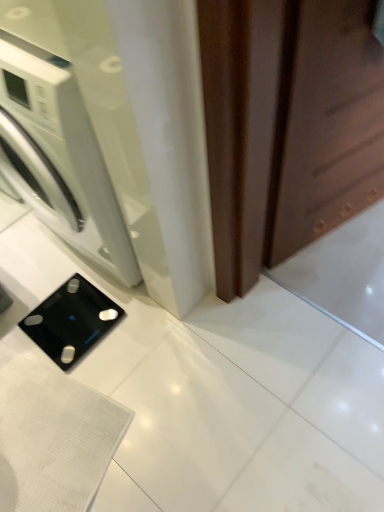
Question: Can you confirm if black glass scale at lower left is wider than brown matte screen door at right?

Choices:
 (A) yes
 (B) no

Answer: (A)

Question: Is black glass scale at lower left positioned with its back to brown matte screen door at right?

Choices:
 (A) yes
 (B) no

Answer: (B)

Question: Is black glass scale at lower left thinner than brown matte screen door at right?

Choices:
 (A) yes
 (B) no

Answer: (B)

Question: Can you confirm if black glass scale at lower left is bigger than brown matte screen door at right?

Choices:
 (A) yes
 (B) no

Answer: (B)

Question: Would you say black glass scale at lower left is outside brown matte screen door at right?

Choices:
 (A) yes
 (B) no

Answer: (A)

Question: Can you confirm if black glass scale at lower left is shorter than brown matte screen door at right?

Choices:
 (A) no
 (B) yes

Answer: (B)

Question: Is white glossy washing machine at left to the right of brown matte screen door at right from the viewer's perspective?

Choices:
 (A) yes
 (B) no

Answer: (B)

Question: Is white glossy washing machine at left directly adjacent to brown matte screen door at right?

Choices:
 (A) yes
 (B) no

Answer: (B)

Question: From a real-world perspective, is white glossy washing machine at left on brown matte screen door at right?

Choices:
 (A) no
 (B) yes

Answer: (A)

Question: Is white glossy washing machine at left further to camera compared to brown matte screen door at right?

Choices:
 (A) yes
 (B) no

Answer: (A)

Question: From the image's perspective, is white glossy washing machine at left above brown matte screen door at right?

Choices:
 (A) no
 (B) yes

Answer: (A)

Question: Is white glossy washing machine at left at the left side of brown matte screen door at right?

Choices:
 (A) no
 (B) yes

Answer: (B)

Question: From a real-world perspective, is brown matte screen door at right positioned over black glass scale at lower left based on gravity?

Choices:
 (A) no
 (B) yes

Answer: (B)